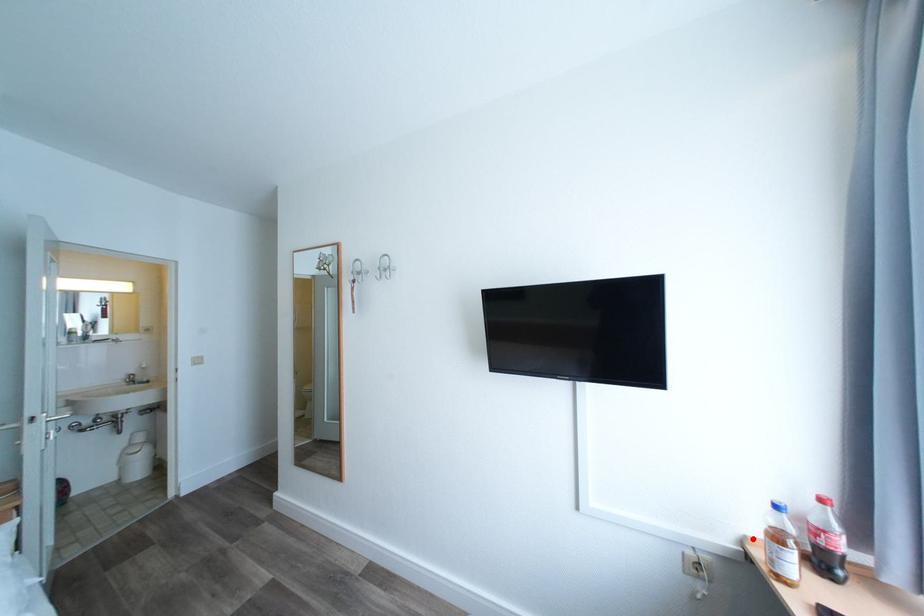
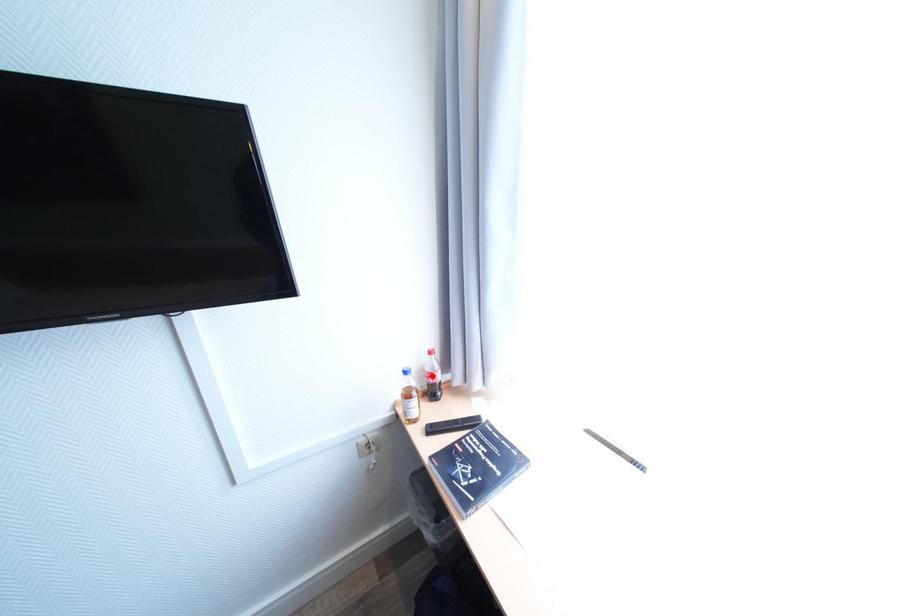
I am providing you with two images of the same scene from different viewpoints. A red point is marked on the first image and another point is marked on the second image. Does the point marked in image1 correspond to the same location as the one in image2?

No